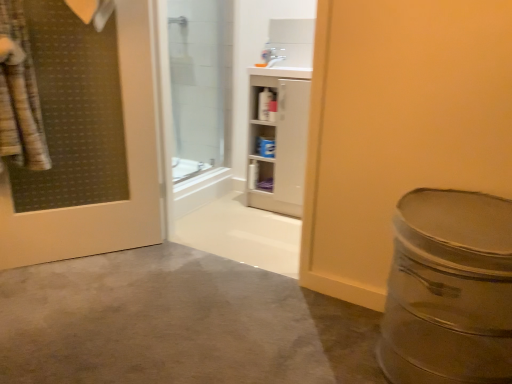
Measure the distance between point (x=297, y=190) and camera.

They are 2.46 meters apart.

In order to face white glossy cabinet at upper center, should I rotate leftwards or rightwards?

Rotate right and turn 1.384 degrees.

Measure the distance between transparent glass shower door at upper center and camera.

The distance of transparent glass shower door at upper center from camera is 7.92 feet.

What do you see at coordinates (196, 98) in the screenshot?
I see `transparent glass shower door at upper center` at bounding box center [196, 98].

Find the location of a particular element. Image resolution: width=512 pixels, height=384 pixels. white glossy cabinet at center is located at coordinates (278, 139).

At what (x,y) coordinates should I click in order to perform the action: click on cabinet behind the white glossy cabinet at center. Please return your answer as a coordinate pair (x, y). This screenshot has width=512, height=384. Looking at the image, I should click on (264, 103).

Considering the sizes of white glossy cabinet at upper center and white glossy cabinet at center in the image, is white glossy cabinet at upper center wider or thinner than white glossy cabinet at center?

In the image, white glossy cabinet at upper center appears to be more narrow than white glossy cabinet at center.

Would you say white glossy cabinet at center is part of white glossy cabinet at upper center's contents?

Definitely not — white glossy cabinet at center is not inside white glossy cabinet at upper center.

How much distance is there between white glossy cabinet at upper center and white glossy cabinet at center?

white glossy cabinet at upper center is 18.38 centimeters from white glossy cabinet at center.

Is white glossy cabinet at upper center looking in the opposite direction of transparent glass shower door at upper center?

No, white glossy cabinet at upper center is not facing the opposite direction of transparent glass shower door at upper center.

From the image's perspective, is white glossy cabinet at upper center over transparent glass shower door at upper center?

No, from the image's perspective, white glossy cabinet at upper center is not above transparent glass shower door at upper center.

How different are the orientations of white glossy cabinet at upper center and transparent glass shower door at upper center in degrees?

The facing directions of white glossy cabinet at upper center and transparent glass shower door at upper center are 88.7 degrees apart.

Is white glossy cabinet at upper center behind transparent glass shower door at upper center?

Yes, white glossy cabinet at upper center is further from the viewer.

Between transparent glass shower door at upper center and white glossy cabinet at upper center, which one has smaller width?

transparent glass shower door at upper center is thinner.

In the scene shown: From the image's perspective, is transparent glass shower door at upper center positioned above or below white glossy cabinet at upper center?

From the image's perspective, transparent glass shower door at upper center appears above white glossy cabinet at upper center.

I want to click on shower door lying above the white glossy cabinet at upper center (from the image's perspective), so [x=196, y=98].

From a real-world perspective, does transparent glass shower door at upper center stand above white glossy cabinet at upper center?

Yes.

Is point (186, 13) positioned before point (273, 152)?

No, it is behind (273, 152).

Is the surface of transparent glass shower door at upper center in direct contact with white glossy cabinet at center?

No.

Is transparent glass shower door at upper center at the right side of white glossy cabinet at center?

No, transparent glass shower door at upper center is not to the right of white glossy cabinet at center.

This screenshot has height=384, width=512. I want to click on shower door above the white glossy cabinet at center (from a real-world perspective), so click(196, 98).

Which object is positioned more to the left, white glossy cabinet at center or white glossy cabinet at upper center?

From the viewer's perspective, white glossy cabinet at upper center appears more on the left side.

Is white glossy cabinet at center far away from white glossy cabinet at upper center?

No, white glossy cabinet at center is not far from white glossy cabinet at upper center.

In terms of size, does white glossy cabinet at center appear bigger or smaller than white glossy cabinet at upper center?

Considering their sizes, white glossy cabinet at center takes up more space than white glossy cabinet at upper center.

Can you confirm if white glossy cabinet at center is taller than white glossy cabinet at upper center?

Yes.

Considering the relative sizes of white glossy cabinet at center and transparent glass shower door at upper center in the image provided, is white glossy cabinet at center smaller than transparent glass shower door at upper center?

No, white glossy cabinet at center is not smaller than transparent glass shower door at upper center.

Which object is wider, white glossy cabinet at center or transparent glass shower door at upper center?

Wider between the two is white glossy cabinet at center.

Is white glossy cabinet at center next to transparent glass shower door at upper center?

No, white glossy cabinet at center is not beside transparent glass shower door at upper center.

In order to click on shower door that appears on the left of white glossy cabinet at center in this screenshot , I will do `click(196, 98)`.

Locate an element on the screen. The width and height of the screenshot is (512, 384). bathroom cabinet on the right of the white glossy cabinet at upper center is located at coordinates (278, 139).

Identify the location of cabinet below the transparent glass shower door at upper center (from a real-world perspective). (264, 103).

From the image, which object appears to be farther from white glossy cabinet at upper center, white glossy cabinet at center or transparent glass shower door at upper center?

transparent glass shower door at upper center is positioned further to the anchor white glossy cabinet at upper center.

In the scene shown: Based on their spatial positions, is transparent glass shower door at upper center or white glossy cabinet at center closer to white glossy cabinet at upper center?

white glossy cabinet at center.

Estimate the real-world distances between objects in this image. Which object is further from white glossy cabinet at center, transparent glass shower door at upper center or white glossy cabinet at upper center?

Among the two, transparent glass shower door at upper center is located further to white glossy cabinet at center.

Estimate the real-world distances between objects in this image. Which object is further from white glossy cabinet at center, white glossy cabinet at upper center or transparent glass shower door at upper center?

transparent glass shower door at upper center lies further to white glossy cabinet at center than the other object.

Estimate the real-world distances between objects in this image. Which object is closer to transparent glass shower door at upper center, white glossy cabinet at center or white glossy cabinet at upper center?

white glossy cabinet at center.

From the image, which object appears to be farther from transparent glass shower door at upper center, white glossy cabinet at upper center or white glossy cabinet at center?

The object further to transparent glass shower door at upper center is white glossy cabinet at upper center.

At what (x,y) coordinates should I click in order to perform the action: click on cabinet situated between transparent glass shower door at upper center and white glossy cabinet at center from left to right. Please return your answer as a coordinate pair (x, y). Image resolution: width=512 pixels, height=384 pixels. Looking at the image, I should click on pos(264,103).